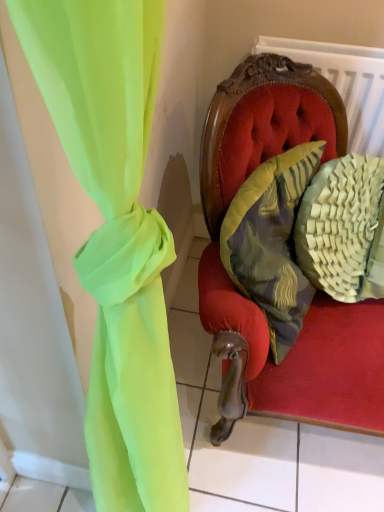
Question: Is woven beige pillow at right, which appears as the 1th pillow when viewed from the right, to the left or to the right of textured yellow pillow at center, placed as the 2th pillow when sorted from right to left, in the image?

Choices:
 (A) left
 (B) right

Answer: (B)

Question: Considering their positions, is woven beige pillow at right, which appears as the 1th pillow when viewed from the right, located in front of or behind textured yellow pillow at center, placed as the 2th pillow when sorted from right to left?

Choices:
 (A) front
 (B) behind

Answer: (B)

Question: Does point (319, 198) appear closer or farther from the camera than point (266, 180)?

Choices:
 (A) closer
 (B) farther

Answer: (B)

Question: Based on their sizes in the image, would you say textured yellow pillow at center, placed as the 2th pillow when sorted from right to left, is bigger or smaller than woven beige pillow at right, which appears as the 1th pillow when viewed from the right?

Choices:
 (A) big
 (B) small

Answer: (A)

Question: Is point (301, 290) closer or farther from the camera than point (316, 190)?

Choices:
 (A) farther
 (B) closer

Answer: (A)

Question: In terms of width, does textured yellow pillow at center, placed as the 2th pillow when sorted from right to left, look wider or thinner when compared to woven beige pillow at right, placed as the second pillow when sorted from left to right?

Choices:
 (A) thin
 (B) wide

Answer: (A)

Question: Is textured yellow pillow at center, the first pillow positioned from the left, taller or shorter than woven beige pillow at right, placed as the second pillow when sorted from left to right?

Choices:
 (A) short
 (B) tall

Answer: (A)